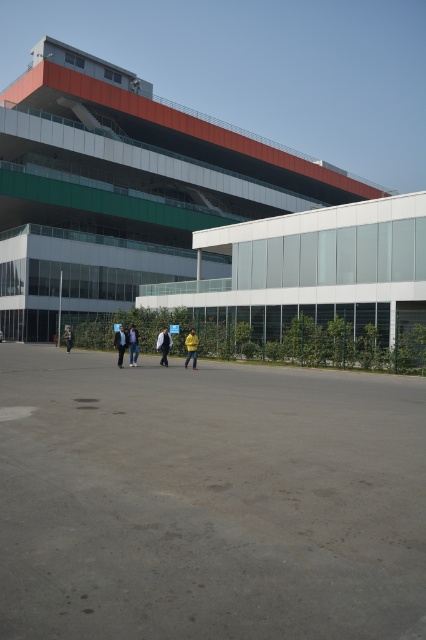
Question: Where is yellow matte jacket at center located in relation to blue denim jacket at center in the image?

Choices:
 (A) above
 (B) below

Answer: (A)

Question: Which object is the closest to the yellow matte jacket at center?

Choices:
 (A) dark blue jacket at center
 (B) gray asphalt plaza at center
 (C) yellow jacket at center
 (D) yellow fabric jacket at center

Answer: (D)

Question: Does yellow matte jacket at center appear on the right side of dark blue jacket at center?

Choices:
 (A) yes
 (B) no

Answer: (A)

Question: Which of the following is the farthest from the observer?

Choices:
 (A) yellow fabric jacket at center
 (B) dark blue jacket at center

Answer: (A)

Question: Which of these objects is positioned closest to the blue denim jacket at center?

Choices:
 (A) yellow jacket at center
 (B) dark blue jacket at center

Answer: (B)

Question: Can you confirm if yellow matte jacket at center is positioned to the left of blue denim jacket at center?

Choices:
 (A) yes
 (B) no

Answer: (B)